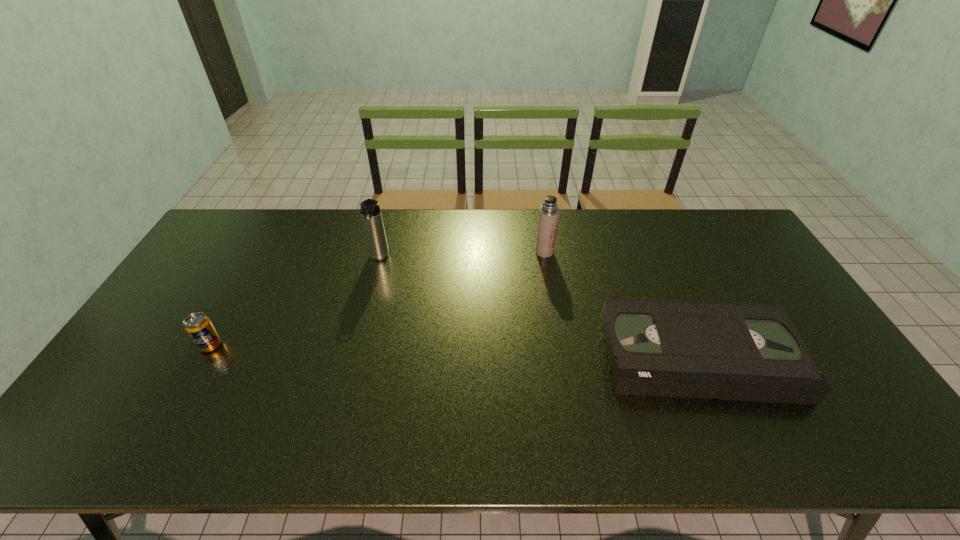
At what (x,y) coordinates should I click in order to perform the action: click on object at the right edge. Please return your answer as a coordinate pair (x, y). This screenshot has width=960, height=540. Looking at the image, I should click on (688, 349).

Locate an element on the screen. This screenshot has height=540, width=960. vacant region at the far edge of the desktop is located at coordinates point(293,224).

Where is `free space at the near edge`? This screenshot has height=540, width=960. free space at the near edge is located at coordinates pyautogui.click(x=779, y=423).

At what (x,y) coordinates should I click in order to perform the action: click on vacant space at the left edge of the desktop. Please return your answer as a coordinate pair (x, y). The height and width of the screenshot is (540, 960). Looking at the image, I should click on (128, 362).

The image size is (960, 540). I want to click on free space at the far right corner of the desktop, so click(x=747, y=238).

The image size is (960, 540). I want to click on unoccupied area between the videotape and the soda can, so click(454, 350).

Where is `vacant area that lies between the left thermos bottle and the right thermos bottle`? The image size is (960, 540). vacant area that lies between the left thermos bottle and the right thermos bottle is located at coordinates (462, 255).

Where is `vacant space that's between the right thermos bottle and the leftmost object`? Image resolution: width=960 pixels, height=540 pixels. vacant space that's between the right thermos bottle and the leftmost object is located at coordinates (377, 299).

You are a GUI agent. You are given a task and a screenshot of the screen. Output one action in this format:
    pyautogui.click(x=<x>, y=<y>)
    Task: Click on the free space between the left thermos bottle and the videotape
    The height and width of the screenshot is (540, 960).
    Given the screenshot: What is the action you would take?
    pyautogui.click(x=539, y=307)

I want to click on free space between the rightmost object and the third object from right to left, so click(x=539, y=307).